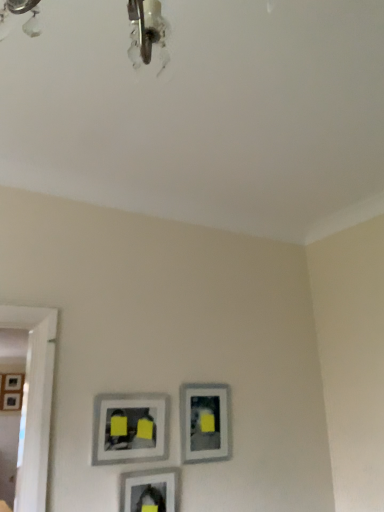
Question: From a real-world perspective, is matte gray picture frame at center, which ranks as the second picture frame in back-to-front order, physically below matte gray picture frame at center, which is the 2th picture frame in front-to-back order?

Choices:
 (A) yes
 (B) no

Answer: (B)

Question: Is matte gray picture frame at center, positioned as the first picture frame in right-to-left order, bigger than matte gray picture frame at center, positioned as the first picture frame in top-to-bottom order?

Choices:
 (A) yes
 (B) no

Answer: (A)

Question: Is matte gray picture frame at center, which is counted as the 4th picture frame, starting from the left, thinner than matte gray picture frame at center, which is the fourth picture frame in bottom-to-top order?

Choices:
 (A) no
 (B) yes

Answer: (A)

Question: Is matte gray picture frame at center, positioned as the first picture frame in right-to-left order, positioned with its back to matte gray picture frame at center, which is the 2th picture frame in front-to-back order?

Choices:
 (A) yes
 (B) no

Answer: (B)

Question: Does matte gray picture frame at center, placed as the second picture frame when sorted from top to bottom, turn towards matte gray picture frame at center, acting as the 3th picture frame starting from the right?

Choices:
 (A) no
 (B) yes

Answer: (A)

Question: Looking at their shapes, would you say matte gray picture frame at lower center, placed as the fourth picture frame when sorted from back to front, is wider or thinner than matte gray picture frame at center, acting as the 3th picture frame starting from the right?

Choices:
 (A) thin
 (B) wide

Answer: (B)

Question: In the image, is matte gray picture frame at lower center, placed as the fourth picture frame when sorted from back to front, on the left side or the right side of matte gray picture frame at center, which is the fourth picture frame in bottom-to-top order?

Choices:
 (A) right
 (B) left

Answer: (A)

Question: Does point (145, 488) appear closer or farther from the camera than point (132, 394)?

Choices:
 (A) closer
 (B) farther

Answer: (A)

Question: From the image's perspective, relative to matte gray picture frame at center, the third picture frame positioned from the back, is matte gray picture frame at lower center, the 3th picture frame viewed from the top, above or below?

Choices:
 (A) above
 (B) below

Answer: (B)

Question: Considering the positions of matte gray picture frame at left, the 1th picture frame when ordered from left to right, and matte gray picture frame at center, arranged as the 3th picture frame when viewed from the front, in the image, is matte gray picture frame at left, the 1th picture frame when ordered from left to right, bigger or smaller than matte gray picture frame at center, arranged as the 3th picture frame when viewed from the front,?

Choices:
 (A) small
 (B) big

Answer: (B)

Question: Does point (16, 380) appear closer or farther from the camera than point (190, 459)?

Choices:
 (A) farther
 (B) closer

Answer: (A)

Question: In the image, is matte gray picture frame at left, placed as the 4th picture frame when sorted from front to back, on the left side or the right side of matte gray picture frame at center, which is counted as the 4th picture frame, starting from the left?

Choices:
 (A) right
 (B) left

Answer: (B)

Question: From a real-world perspective, is matte gray picture frame at left, which is the 4th picture frame from top to bottom, physically located above or below matte gray picture frame at center, which is counted as the 4th picture frame, starting from the left?

Choices:
 (A) above
 (B) below

Answer: (A)

Question: Looking at the image, does matte gray picture frame at center, which is the 2th picture frame in front-to-back order, seem bigger or smaller compared to matte gray picture frame at lower center, which is the third picture frame from left to right?

Choices:
 (A) big
 (B) small

Answer: (B)

Question: From a real-world perspective, is matte gray picture frame at center, placed as the 2th picture frame when sorted from left to right, above or below matte gray picture frame at lower center, which is the 1th picture frame in front-to-back order?

Choices:
 (A) above
 (B) below

Answer: (A)